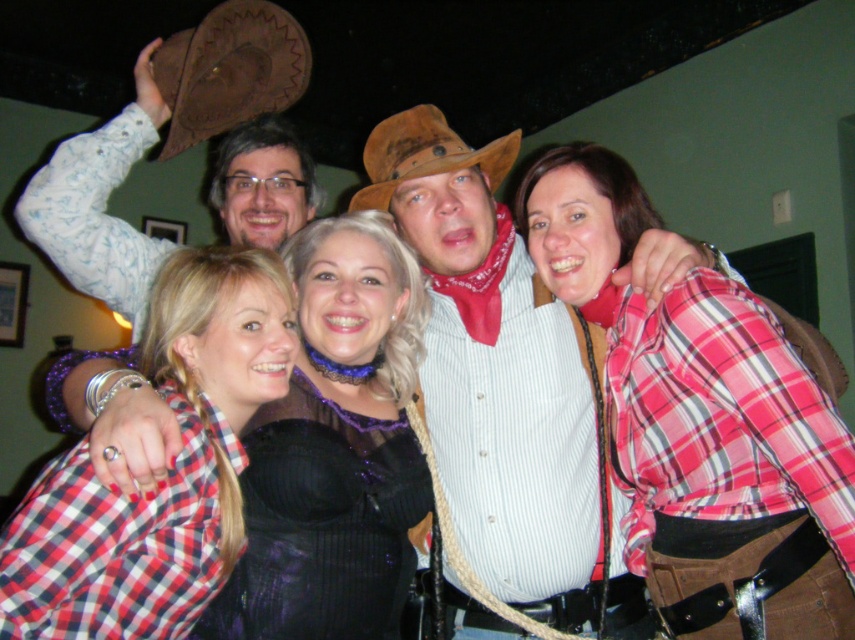
Can you confirm if checkered fabric shirt at lower left is bigger than brown leather cowboy hat at center?

Yes.

Which is below, checkered fabric shirt at lower left or brown leather cowboy hat at center?

Positioned lower is checkered fabric shirt at lower left.

Where is `checkered fabric shirt at lower left`? This screenshot has height=640, width=855. checkered fabric shirt at lower left is located at coordinates (332, 474).

The width and height of the screenshot is (855, 640). Find the location of `checkered fabric shirt at lower left`. checkered fabric shirt at lower left is located at coordinates [332, 474].

Is matte brown cowboy hat at center to the left of checkered fabric shirt at lower left from the viewer's perspective?

No, matte brown cowboy hat at center is not to the left of checkered fabric shirt at lower left.

Which is behind, point (470, 442) or point (416, 314)?

Point (470, 442)

Is point (485, 195) positioned in front of point (279, 552)?

That is False.

You are a GUI agent. You are given a task and a screenshot of the screen. Output one action in this format:
    pyautogui.click(x=<x>, y=<y>)
    Task: Click on the matte brown cowboy hat at center
    Image resolution: width=855 pixels, height=640 pixels.
    Given the screenshot: What is the action you would take?
    pyautogui.click(x=493, y=364)

Between checkered fabric shirt at lower left and brown leather cowboy hat at upper left, which one appears on the left side from the viewer's perspective?

Positioned to the left is brown leather cowboy hat at upper left.

Is checkered fabric shirt at lower left above brown leather cowboy hat at upper left?

No.

Describe the element at coordinates (332, 474) in the screenshot. I see `checkered fabric shirt at lower left` at that location.

The width and height of the screenshot is (855, 640). What are the coordinates of `checkered fabric shirt at lower left` in the screenshot? It's located at (332, 474).